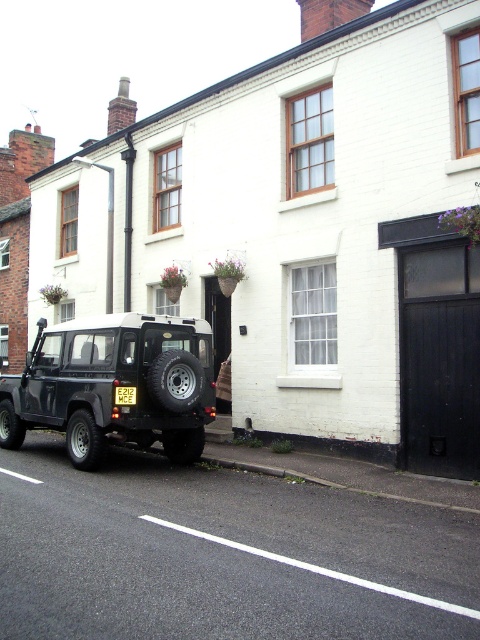
Question: Is matte black jeep at lower left smaller than yellow plastic license plate at center?

Choices:
 (A) yes
 (B) no

Answer: (B)

Question: Which point appears closest to the camera in this image?

Choices:
 (A) (117, 428)
 (B) (117, 387)

Answer: (B)

Question: Does matte black jeep at lower left have a smaller size compared to yellow plastic license plate at center?

Choices:
 (A) no
 (B) yes

Answer: (A)

Question: Which point is farther to the camera?

Choices:
 (A) matte black jeep at lower left
 (B) yellow plastic license plate at center

Answer: (B)

Question: In this image, where is matte black jeep at lower left located relative to yellow plastic license plate at center?

Choices:
 (A) above
 (B) below

Answer: (B)

Question: Among these points, which one is farthest from the camera?

Choices:
 (A) (131, 333)
 (B) (126, 404)

Answer: (A)